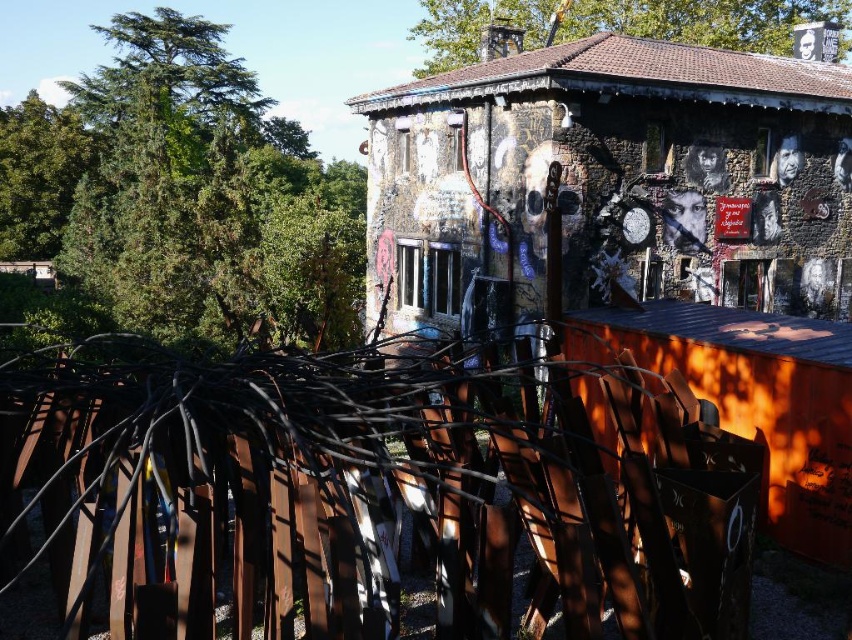
Question: Which of the following is the farthest from the observer?

Choices:
 (A) (35, 188)
 (B) (98, 456)
 (C) (533, 32)

Answer: (A)

Question: Is green leafy tree at upper left positioned before green leafy tree at upper center?

Choices:
 (A) yes
 (B) no

Answer: (A)

Question: Is rusty metal fence at center smaller than green leafy tree at upper left?

Choices:
 (A) no
 (B) yes

Answer: (B)

Question: Estimate the real-world distances between objects in this image. Which object is closer to the green leafy tree at left?

Choices:
 (A) green leafy tree at upper left
 (B) rusty metal fence at center
 (C) green leafy tree at upper center

Answer: (A)

Question: Which point is farther to the camera?

Choices:
 (A) green leafy tree at upper left
 (B) green leafy tree at left
 (C) rusty metal fence at center

Answer: (B)

Question: Observing the image, what is the correct spatial positioning of rusty metal fence at center in reference to green leafy tree at upper left?

Choices:
 (A) left
 (B) right

Answer: (B)